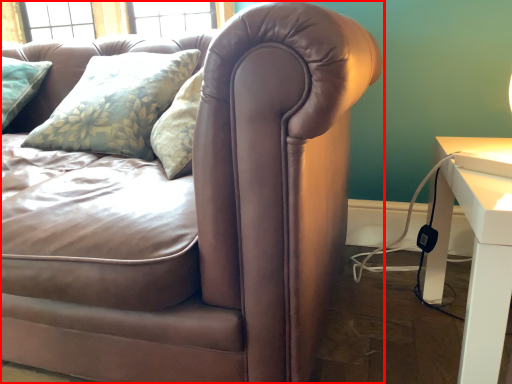
Question: From the image's perspective, considering the relative positions of studio couch (annotated by the red box) and table in the image provided, where is studio couch (annotated by the red box) located with respect to the staircase?

Choices:
 (A) below
 (B) above

Answer: (B)